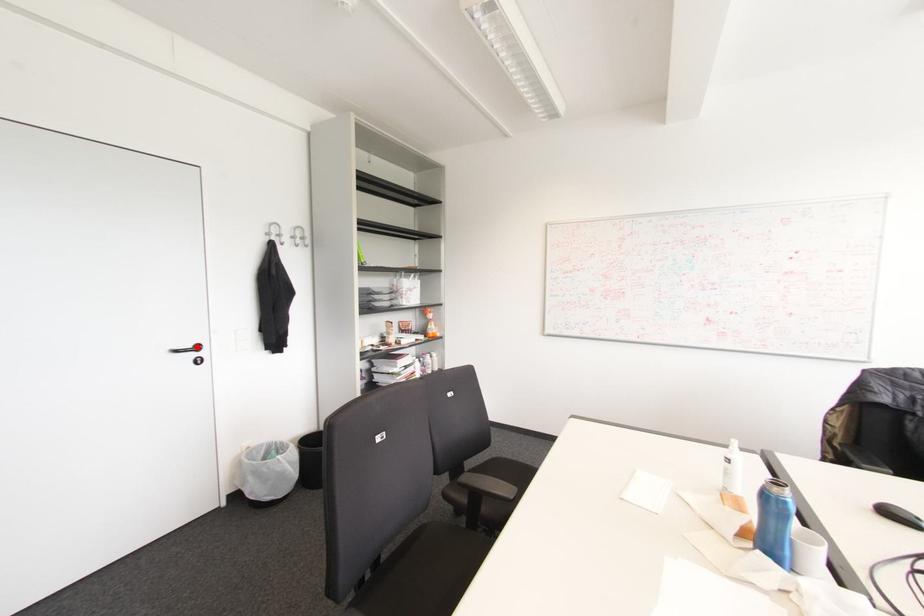
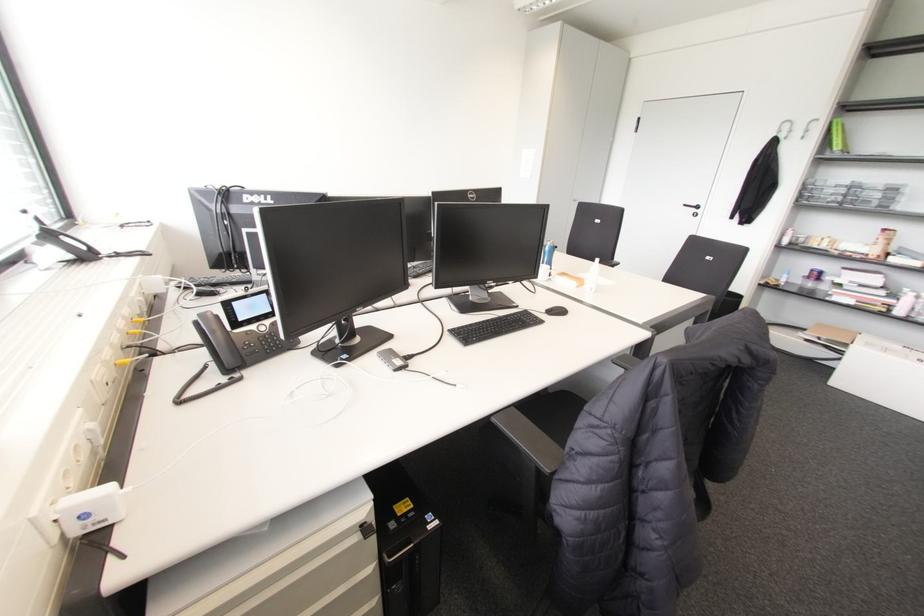
Locate, in the second image, the point that corresponds to the highlighted location in the first image.

(697, 207)